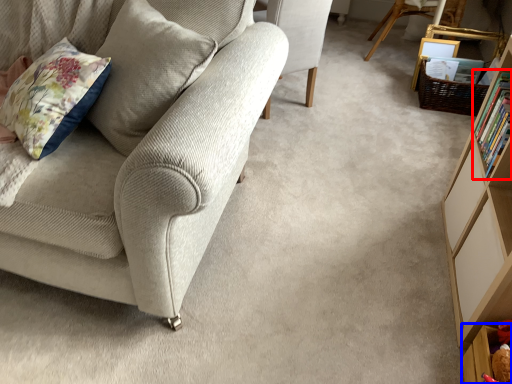
Question: Among these objects, which one is farthest to the camera, book (highlighted by a red box) or shelf (highlighted by a blue box)?

Choices:
 (A) book
 (B) shelf

Answer: (A)